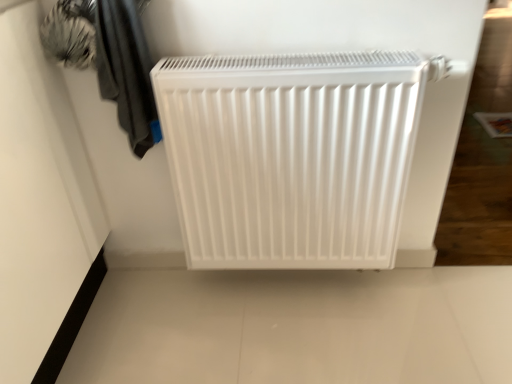
Question: Would you say white matte radiator at center contains dark gray fabric at upper left?

Choices:
 (A) no
 (B) yes

Answer: (A)

Question: Does white matte radiator at center have a smaller size compared to dark gray fabric at upper left?

Choices:
 (A) yes
 (B) no

Answer: (B)

Question: Is white matte radiator at center to the right of dark gray fabric at upper left from the viewer's perspective?

Choices:
 (A) no
 (B) yes

Answer: (B)

Question: Can you confirm if white matte radiator at center is bigger than dark gray fabric at upper left?

Choices:
 (A) no
 (B) yes

Answer: (B)

Question: From a real-world perspective, does white matte radiator at center stand above dark gray fabric at upper left?

Choices:
 (A) yes
 (B) no

Answer: (B)

Question: From the image's perspective, is white matte radiator at center beneath dark gray fabric at upper left?

Choices:
 (A) yes
 (B) no

Answer: (A)

Question: Does dark gray fabric at upper left have a larger size compared to white matte radiator at center?

Choices:
 (A) no
 (B) yes

Answer: (A)

Question: Is dark gray fabric at upper left placed right next to white matte radiator at center?

Choices:
 (A) yes
 (B) no

Answer: (B)

Question: Is dark gray fabric at upper left in front of white matte radiator at center?

Choices:
 (A) no
 (B) yes

Answer: (B)

Question: Does dark gray fabric at upper left have a greater height compared to white matte radiator at center?

Choices:
 (A) no
 (B) yes

Answer: (A)

Question: Does dark gray fabric at upper left turn towards white matte radiator at center?

Choices:
 (A) yes
 (B) no

Answer: (B)

Question: Can you confirm if dark gray fabric at upper left is thinner than white matte radiator at center?

Choices:
 (A) no
 (B) yes

Answer: (A)

Question: From the image's perspective, is white matte radiator at center positioned above or below dark gray fabric at upper left?

Choices:
 (A) above
 (B) below

Answer: (B)